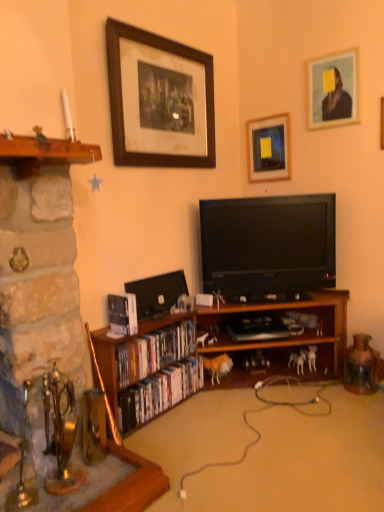
Question: Is matte black picture frame at upper center, marked as the 2th picture frame in a left-to-right arrangement, not inside black glossy flat-screen tv at center?

Choices:
 (A) yes
 (B) no

Answer: (A)

Question: Does matte black picture frame at upper center, placed as the second picture frame when sorted from right to left, have a greater width compared to black glossy flat-screen tv at center?

Choices:
 (A) yes
 (B) no

Answer: (B)

Question: Is matte black picture frame at upper center, placed as the second picture frame when sorted from right to left, in front of black glossy flat-screen tv at center?

Choices:
 (A) yes
 (B) no

Answer: (B)

Question: Is the depth of matte black picture frame at upper center, placed as the second picture frame when sorted from right to left, greater than that of black glossy flat-screen tv at center?

Choices:
 (A) no
 (B) yes

Answer: (B)

Question: From a real-world perspective, is matte black picture frame at upper center, marked as the 2th picture frame in a left-to-right arrangement, on top of black glossy flat-screen tv at center?

Choices:
 (A) yes
 (B) no

Answer: (A)

Question: Is matte black picture frame at upper center, placed as the second picture frame when sorted from right to left, to the right of black glossy flat-screen tv at center from the viewer's perspective?

Choices:
 (A) yes
 (B) no

Answer: (A)

Question: Is matte plastic dvds at lower left, placed as the first book when sorted from bottom to top, next to wooden bookshelf at center?

Choices:
 (A) yes
 (B) no

Answer: (B)

Question: From a real-world perspective, is matte plastic dvds at lower left, marked as the third book in a top-to-bottom arrangement, on top of wooden bookshelf at center?

Choices:
 (A) yes
 (B) no

Answer: (B)

Question: Would you consider matte plastic dvds at lower left, placed as the first book when sorted from bottom to top, to be distant from wooden bookshelf at center?

Choices:
 (A) no
 (B) yes

Answer: (A)

Question: From a real-world perspective, is matte plastic dvds at lower left, marked as the third book in a top-to-bottom arrangement, under wooden bookshelf at center?

Choices:
 (A) no
 (B) yes

Answer: (B)

Question: Does matte plastic dvds at lower left, placed as the first book when sorted from bottom to top, appear on the left side of wooden bookshelf at center?

Choices:
 (A) yes
 (B) no

Answer: (A)

Question: Does matte plastic dvds at lower left, placed as the first book when sorted from bottom to top, have a greater width compared to wooden bookshelf at center?

Choices:
 (A) yes
 (B) no

Answer: (B)

Question: Is hardcover book at lower left, the 3th book ordered from the bottom, not inside matte plastic dvds at lower left, marked as the third book in a top-to-bottom arrangement?

Choices:
 (A) no
 (B) yes

Answer: (B)